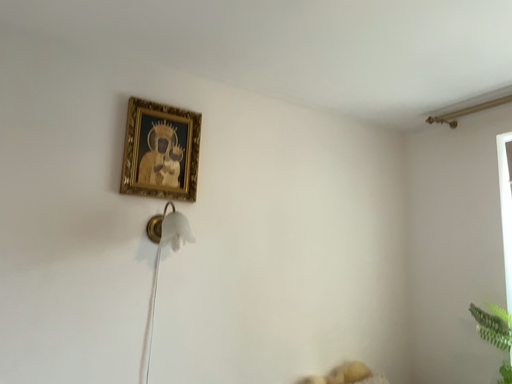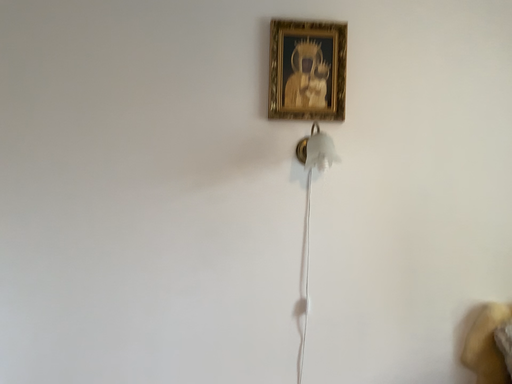
Question: Which way did the camera rotate in the video?

Choices:
 (A) rotated left
 (B) rotated right

Answer: (A)